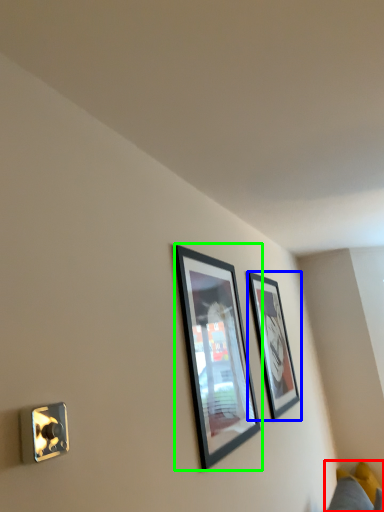
Question: Which is farther away from couch (highlighted by a red box)? picture frame (highlighted by a blue box) or picture frame (highlighted by a green box)?

Choices:
 (A) picture frame
 (B) picture frame

Answer: (B)